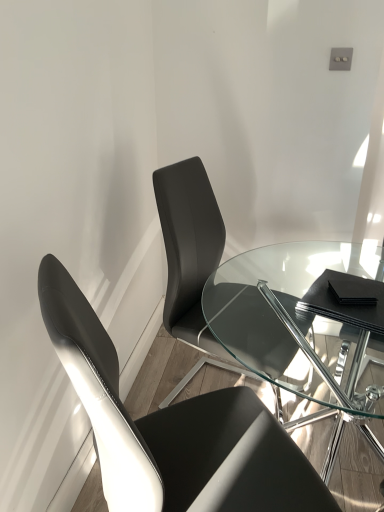
The height and width of the screenshot is (512, 384). Find the location of `black leather chair at left, the first chair viewed from the front`. black leather chair at left, the first chair viewed from the front is located at coordinates (174, 430).

Are matte black chair at center, acting as the 2th chair starting from the front, and transparent glass table at center located far from each other?

No, there isn't a large distance between matte black chair at center, acting as the 2th chair starting from the front, and transparent glass table at center.

Relative to transparent glass table at center, is matte black chair at center, positioned as the 1th chair in back-to-front order, in front or behind?

matte black chair at center, positioned as the 1th chair in back-to-front order, is behind transparent glass table at center.

Is matte black chair at center, positioned as the 1th chair in back-to-front order, wider or thinner than transparent glass table at center?

Clearly, matte black chair at center, positioned as the 1th chair in back-to-front order, has less width compared to transparent glass table at center.

From the image's perspective, is matte black chair at center, acting as the 2th chair starting from the front, located beneath transparent glass table at center?

Incorrect, from the image's perspective, matte black chair at center, acting as the 2th chair starting from the front, is higher than transparent glass table at center.

Find the location of `table on the right of the black leather chair at left, the first chair viewed from the front`. table on the right of the black leather chair at left, the first chair viewed from the front is located at coordinates (298, 328).

Is transparent glass table at center completely or partially inside black leather chair at left, the first chair viewed from the front?

Actually, transparent glass table at center is outside black leather chair at left, the first chair viewed from the front.

Which object is positioned more to the left, black leather chair at left, the 2th chair viewed from the back, or transparent glass table at center?

black leather chair at left, the 2th chair viewed from the back.

Does black leather chair at left, the first chair viewed from the front, turn towards transparent glass table at center?

Yes, black leather chair at left, the first chair viewed from the front, faces towards transparent glass table at center.

Where is `chair that appears on the right of black leather chair at left, the first chair viewed from the front`? This screenshot has width=384, height=512. chair that appears on the right of black leather chair at left, the first chair viewed from the front is located at coordinates (190, 260).

Are black leather chair at left, the first chair viewed from the front, and matte black chair at center, acting as the 2th chair starting from the front, beside each other?

black leather chair at left, the first chair viewed from the front, is not next to matte black chair at center, acting as the 2th chair starting from the front, and they're not touching.

Who is bigger, black leather chair at left, the first chair viewed from the front, or matte black chair at center, acting as the 2th chair starting from the front?

black leather chair at left, the first chair viewed from the front, is bigger.

Between black leather chair at left, the first chair viewed from the front, and matte black chair at center, acting as the 2th chair starting from the front, which one appears on the left side from the viewer's perspective?

Positioned to the left is black leather chair at left, the first chair viewed from the front.

Considering the relative sizes of transparent glass table at center and matte black chair at center, acting as the 2th chair starting from the front, in the image provided, is transparent glass table at center wider than matte black chair at center, acting as the 2th chair starting from the front,?

Yes, transparent glass table at center is wider than matte black chair at center, acting as the 2th chair starting from the front.

What's the angular difference between transparent glass table at center and matte black chair at center, positioned as the 1th chair in back-to-front order,'s facing directions?

The angular difference between transparent glass table at center and matte black chair at center, positioned as the 1th chair in back-to-front order, is 19.7 degrees.

Is transparent glass table at center aimed at matte black chair at center, acting as the 2th chair starting from the front?

No, transparent glass table at center is not facing towards matte black chair at center, acting as the 2th chair starting from the front.

Does point (282, 372) appear closer or farther from the camera than point (145, 441)?

Point (282, 372) is farther from the camera than point (145, 441).

Between transparent glass table at center and black leather chair at left, the first chair viewed from the front, which one has less height?

transparent glass table at center.

Considering the relative sizes of transparent glass table at center and black leather chair at left, the first chair viewed from the front, in the image provided, is transparent glass table at center bigger than black leather chair at left, the first chair viewed from the front,?

Yes, transparent glass table at center is bigger than black leather chair at left, the first chair viewed from the front.

From the picture: Can black leather chair at left, the first chair viewed from the front, be found inside transparent glass table at center?

No, black leather chair at left, the first chair viewed from the front, is not surrounded by transparent glass table at center.

Based on the photo, what's the angular difference between matte black chair at center, acting as the 2th chair starting from the front, and black leather chair at left, the first chair viewed from the front,'s facing directions?

matte black chair at center, acting as the 2th chair starting from the front, and black leather chair at left, the first chair viewed from the front, are facing 53 degrees away from each other.

Relative to black leather chair at left, the first chair viewed from the front, is matte black chair at center, positioned as the 1th chair in back-to-front order, in front or behind?

Visually, matte black chair at center, positioned as the 1th chair in back-to-front order, is located behind black leather chair at left, the first chair viewed from the front.

Which is more distant, (221, 253) or (229, 490)?

Point (221, 253)

Considering the relative sizes of matte black chair at center, positioned as the 1th chair in back-to-front order, and black leather chair at left, the first chair viewed from the front, in the image provided, is matte black chair at center, positioned as the 1th chair in back-to-front order, wider than black leather chair at left, the first chair viewed from the front,?

In fact, matte black chair at center, positioned as the 1th chair in back-to-front order, might be narrower than black leather chair at left, the first chair viewed from the front.

Identify the location of table directly beneath the matte black chair at center, positioned as the 1th chair in back-to-front order (from a real-world perspective). pos(298,328).

This screenshot has height=512, width=384. Find the location of `table lying behind the black leather chair at left, the first chair viewed from the front`. table lying behind the black leather chair at left, the first chair viewed from the front is located at coordinates (298, 328).

Based on their spatial positions, is black leather chair at left, the 2th chair viewed from the back, or transparent glass table at center further from matte black chair at center, acting as the 2th chair starting from the front?

Among the two, black leather chair at left, the 2th chair viewed from the back, is located further to matte black chair at center, acting as the 2th chair starting from the front.

Considering their positions, is matte black chair at center, acting as the 2th chair starting from the front, positioned further to transparent glass table at center than black leather chair at left, the 2th chair viewed from the back?

black leather chair at left, the 2th chair viewed from the back, is positioned further to the anchor transparent glass table at center.

Considering their positions, is transparent glass table at center positioned further to black leather chair at left, the 2th chair viewed from the back, than matte black chair at center, positioned as the 1th chair in back-to-front order?

transparent glass table at center lies further to black leather chair at left, the 2th chair viewed from the back, than the other object.

Looking at the image, which one is located closer to transparent glass table at center, black leather chair at left, the first chair viewed from the front, or matte black chair at center, positioned as the 1th chair in back-to-front order?

matte black chair at center, positioned as the 1th chair in back-to-front order, is closer to transparent glass table at center.

Based on their spatial positions, is transparent glass table at center or black leather chair at left, the 2th chair viewed from the back, further from matte black chair at center, acting as the 2th chair starting from the front?

The object further to matte black chair at center, acting as the 2th chair starting from the front, is black leather chair at left, the 2th chair viewed from the back.

Looking at the image, which one is located closer to black leather chair at left, the first chair viewed from the front, matte black chair at center, acting as the 2th chair starting from the front, or transparent glass table at center?

Based on the image, matte black chair at center, acting as the 2th chair starting from the front, appears to be nearer to black leather chair at left, the first chair viewed from the front.

This screenshot has height=512, width=384. Identify the location of table between black leather chair at left, the 2th chair viewed from the back, and matte black chair at center, acting as the 2th chair starting from the front, from front to back. (298, 328).